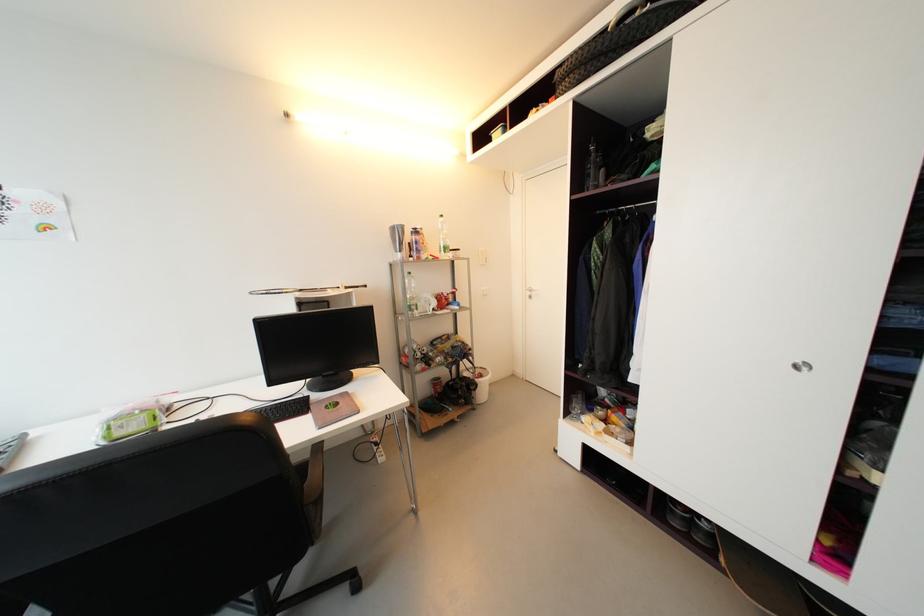
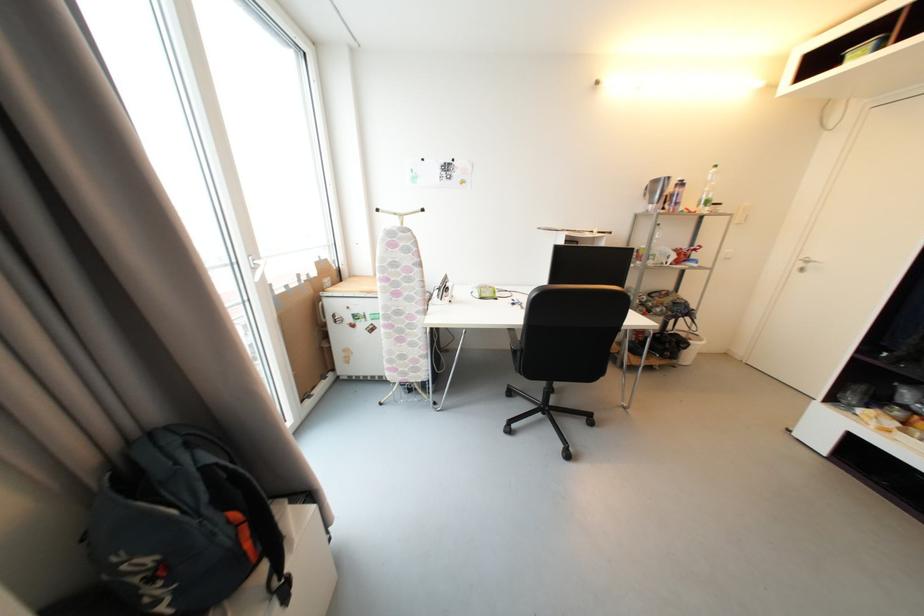
Question: The camera is either moving clockwise (left) or counter-clockwise (right) around the object. The first image is from the beginning of the video and the second image is from the end. Is the camera moving left or right when shooting the video?

Choices:
 (A) Left
 (B) Right

Answer: (B)